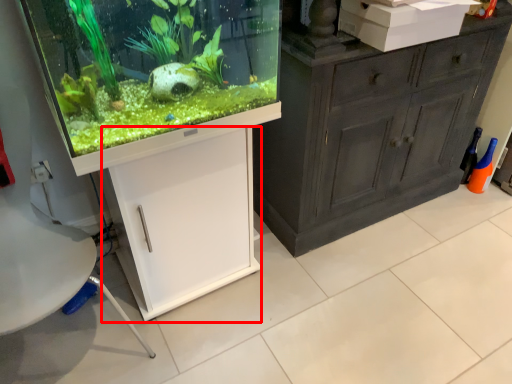
Question: Where is cabinetry (annotated by the red box) located in relation to box in the image?

Choices:
 (A) right
 (B) left

Answer: (B)